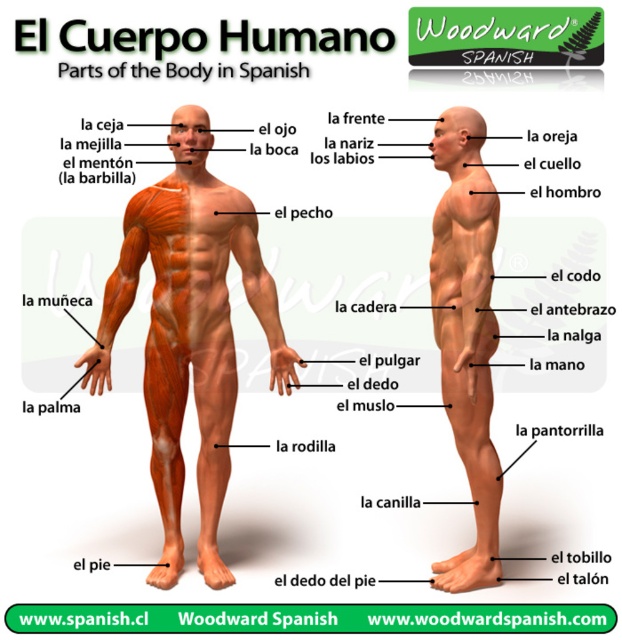
You are a student learning Spanish anatomy terms. You see the matte orange muscle at center and the matte orange muscle at right in the illustration. Which one is closer to you?

The matte orange muscle at center is closer to you because it is further to the viewer than the matte orange muscle at right.

You are a student learning anatomy and need to identify the muscles in the illustration. The teacher asks which of the two matte orange muscles is taller. You see the matte orange muscle at center and the matte orange muscle at right. Based on their positions, which one is taller?

The matte orange muscle at center has a greater height compared to the matte orange muscle at right, so the matte orange muscle at center is taller.

You are a student learning Spanish anatomy terms. You see the image with the matte orange muscle at center and the matte orange muscle at right. Which one is positioned to the left of the other?

The matte orange muscle at center is positioned to the left of the matte orange muscle at right.